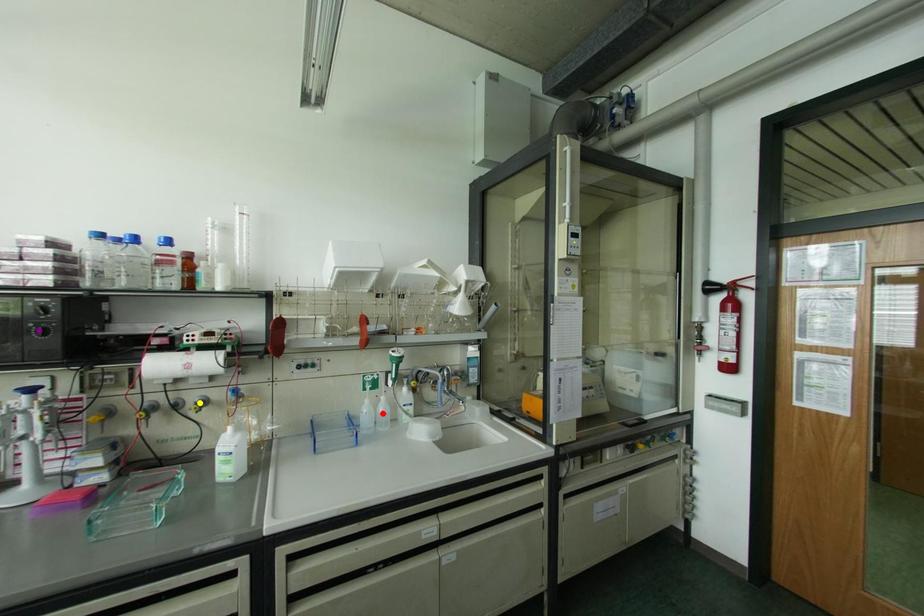
Order these from nearest to farthest:
- purple point
- yellow point
- red point

purple point → yellow point → red point